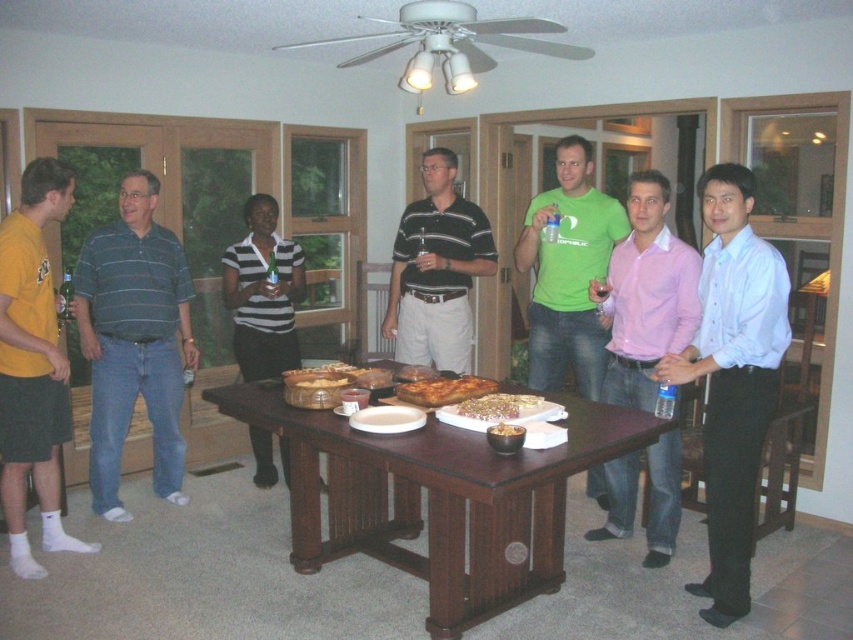
Question: Among these points, which one is farthest from the camera?

Choices:
 (A) (648, 404)
 (B) (764, 400)
 (C) (444, 378)
 (D) (358, 490)

Answer: (C)

Question: Considering the real-world distances, which object is farthest from the wooden table at center?

Choices:
 (A) striped polo shirt at center
 (B) pink cotton shirt at center
 (C) green matte t-shirt at center

Answer: (C)

Question: Does white matte plate at center have a smaller size compared to golden brown crusty bread at center?

Choices:
 (A) yes
 (B) no

Answer: (A)

Question: Does matte yellow t-shirt at left come behind golden brown bread at center?

Choices:
 (A) no
 (B) yes

Answer: (B)

Question: Among these objects, which one is nearest to the camera?

Choices:
 (A) white glossy plate at center
 (B) golden crispy bread at center
 (C) green matte t-shirt at center
 (D) golden brown bread at center

Answer: (D)

Question: Can you confirm if matte yellow t-shirt at left is positioned below white glossy plate at center?

Choices:
 (A) yes
 (B) no

Answer: (B)